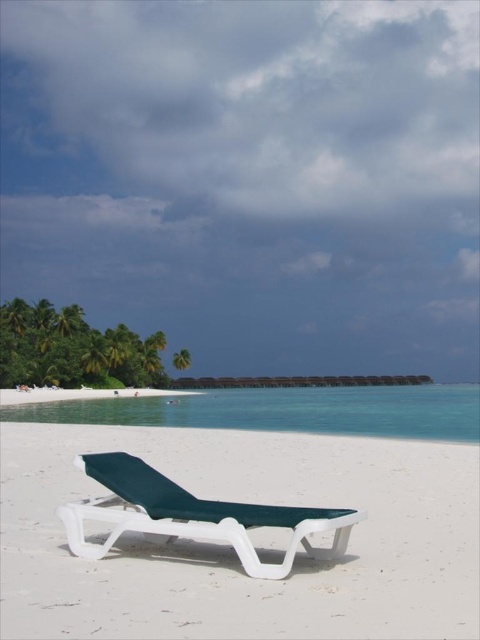
You are standing on the white sand beach at lower left and want to move to the white plastic beach chair at center. Which direction should you walk to reach it?

You should walk to the right to reach the white plastic beach chair at center since it is positioned to the right of the white sand beach at lower left.

You are a beach maintenance worker needing to transport a 100 feet long hose from the white plastic beach chair at center to the white sand beach at lower left. Can you do this without the hose extending beyond the area between them?

The distance between the white plastic beach chair at center and the white sand beach at lower left is 212.83 feet, which is greater than the 100 feet length of the hose. Therefore, the hose will not extend beyond the area between them.

From the picture: You are standing at the edge of the beach and want to walk from the white sand beach at lower left to the white sand at center. Which direction should you head?

You should head to the right because the white sand at center is positioned on the right side of the white sand beach at lower left.